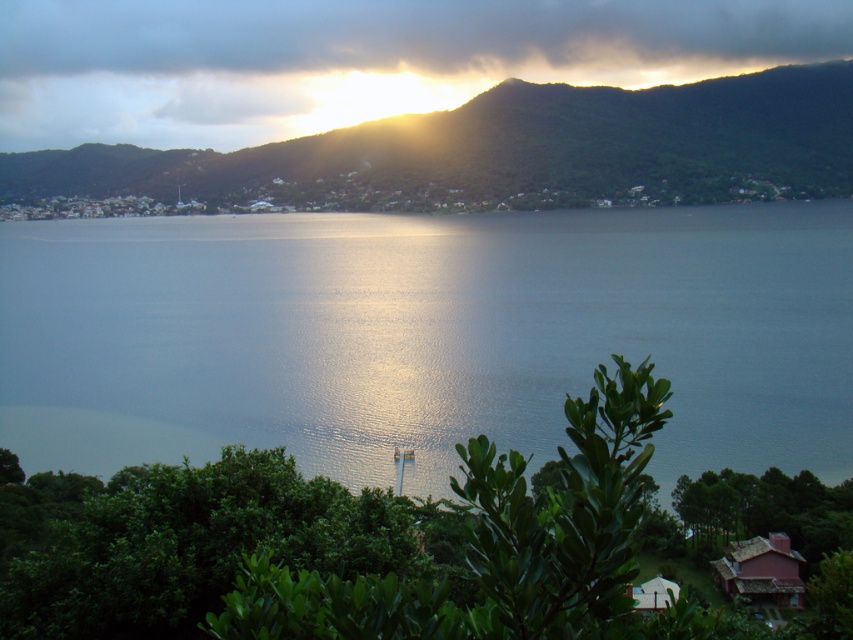
You are a photographer trying to capture the cloudy sky at upper center in your shot. Based on its position, which part of the image should you focus on to ensure it is included in the frame?

The cloudy sky at upper center is located at point (x=357, y=58), so you should focus on the upper center area of the image to include it in the frame.

Based on the photo, you are standing at the edge of the landscape and want to take a photo of the glistening blue water at center and the cloudy sky at upper center. Which object is positioned to the right side of the other?

The glistening blue water at center is to the right of cloudy sky at upper center.